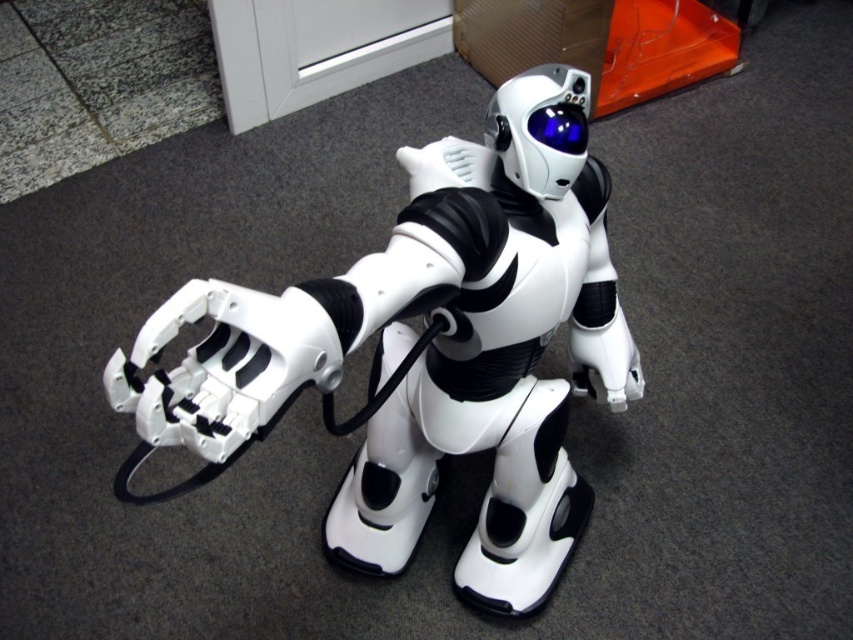
Question: Is white matte robot at center bigger than glossy plastic goggles at upper center?

Choices:
 (A) yes
 (B) no

Answer: (A)

Question: Which point appears closest to the camera in this image?

Choices:
 (A) (538, 140)
 (B) (544, 88)

Answer: (A)

Question: Is white matte robot at center wider than glossy plastic goggles at upper center?

Choices:
 (A) yes
 (B) no

Answer: (A)

Question: Is white matte robot at center above glossy plastic goggles at upper center?

Choices:
 (A) no
 (B) yes

Answer: (A)